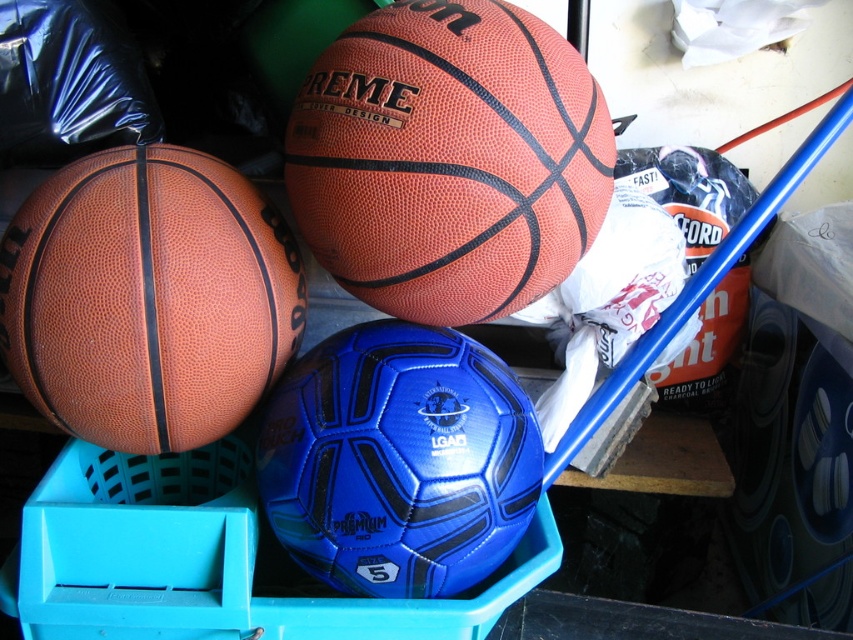
Question: Where is leather basketball at center located in relation to matte orange basketball at left in the image?

Choices:
 (A) above
 (B) below

Answer: (A)

Question: Can you confirm if leather basketball at center is positioned to the right of matte orange basketball at left?

Choices:
 (A) yes
 (B) no

Answer: (A)

Question: Which point appears farthest from the camera in this image?

Choices:
 (A) (171, 353)
 (B) (527, 173)

Answer: (A)

Question: Does leather basketball at center have a smaller size compared to matte orange basketball at left?

Choices:
 (A) no
 (B) yes

Answer: (A)